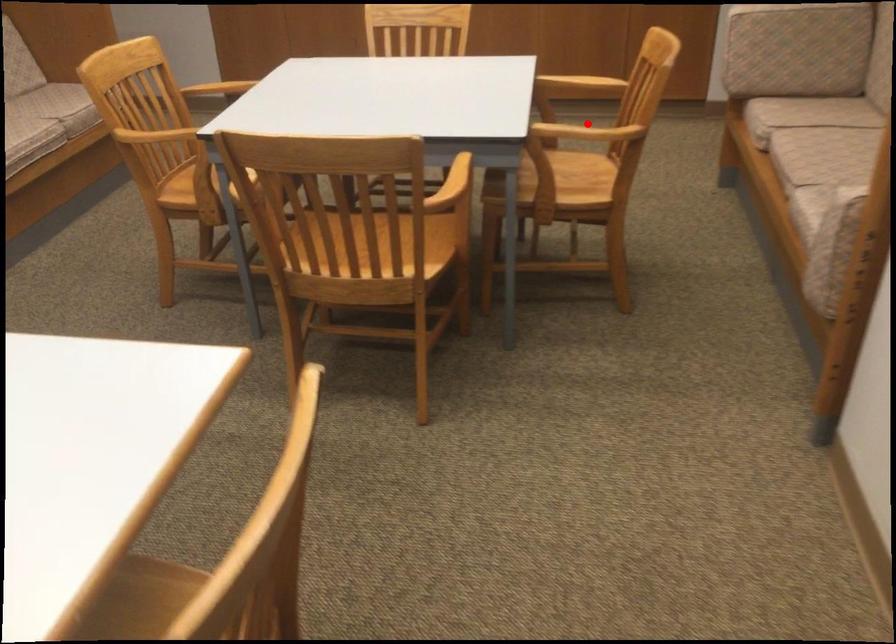
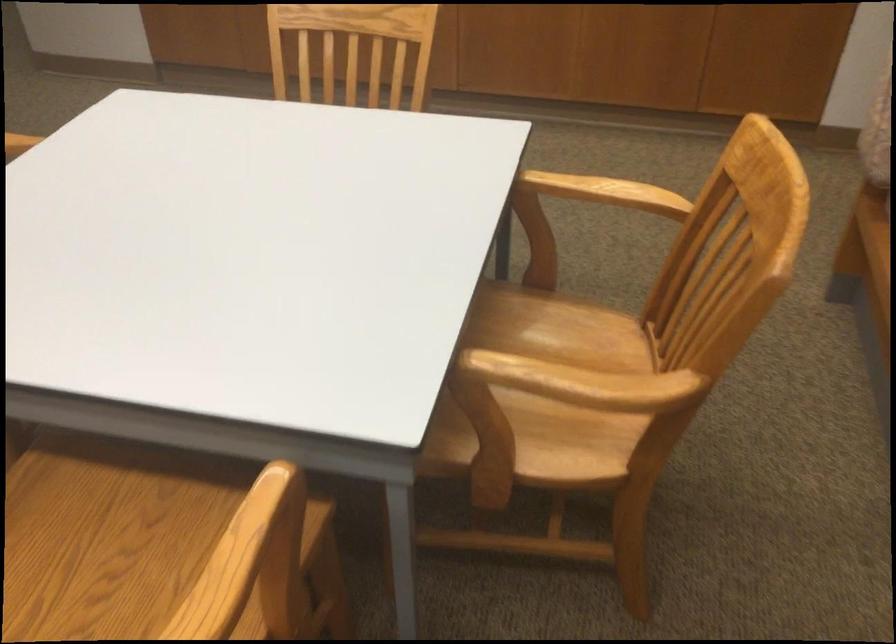
Locate, in the second image, the point that corresponds to the highlighted location in the first image.

(583, 383)